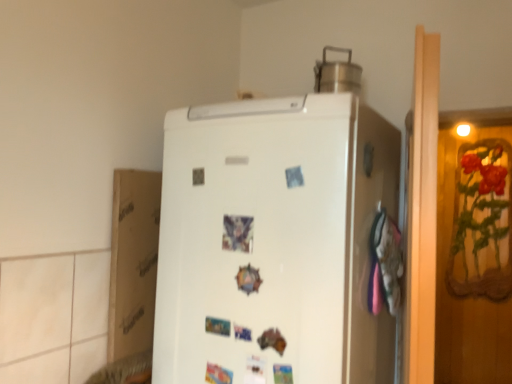
Question: Could you tell me if brushed metal pot at upper center is facing white matte refrigerator at center?

Choices:
 (A) no
 (B) yes

Answer: (A)

Question: Does brushed metal pot at upper center have a lesser height compared to white matte refrigerator at center?

Choices:
 (A) no
 (B) yes

Answer: (B)

Question: Does brushed metal pot at upper center contain white matte refrigerator at center?

Choices:
 (A) yes
 (B) no

Answer: (B)

Question: Is brushed metal pot at upper center closer to camera compared to white matte refrigerator at center?

Choices:
 (A) yes
 (B) no

Answer: (B)

Question: Is white matte refrigerator at center at the back of brushed metal pot at upper center?

Choices:
 (A) no
 (B) yes

Answer: (A)

Question: Based on their sizes in the image, would you say white matte refrigerator at center is bigger or smaller than white cardboard at left?

Choices:
 (A) big
 (B) small

Answer: (A)

Question: Considering the positions of point (364, 253) and point (130, 301), is point (364, 253) closer or farther from the camera than point (130, 301)?

Choices:
 (A) closer
 (B) farther

Answer: (A)

Question: Considering the positions of white matte refrigerator at center and white cardboard at left in the image, is white matte refrigerator at center taller or shorter than white cardboard at left?

Choices:
 (A) tall
 (B) short

Answer: (A)

Question: In terms of width, does white matte refrigerator at center look wider or thinner when compared to white cardboard at left?

Choices:
 (A) thin
 (B) wide

Answer: (B)

Question: Which is correct: brushed metal pot at upper center is inside white cardboard at left, or outside of it?

Choices:
 (A) outside
 (B) inside

Answer: (A)

Question: In terms of height, does brushed metal pot at upper center look taller or shorter compared to white cardboard at left?

Choices:
 (A) tall
 (B) short

Answer: (B)

Question: Is point (343, 82) positioned closer to the camera than point (125, 216)?

Choices:
 (A) farther
 (B) closer

Answer: (A)

Question: Looking at their shapes, would you say brushed metal pot at upper center is wider or thinner than white cardboard at left?

Choices:
 (A) wide
 (B) thin

Answer: (A)

Question: In terms of height, does white matte refrigerator at center look taller or shorter compared to brushed metal pot at upper center?

Choices:
 (A) tall
 (B) short

Answer: (A)

Question: In the image, is white matte refrigerator at center positioned in front of or behind brushed metal pot at upper center?

Choices:
 (A) front
 (B) behind

Answer: (A)